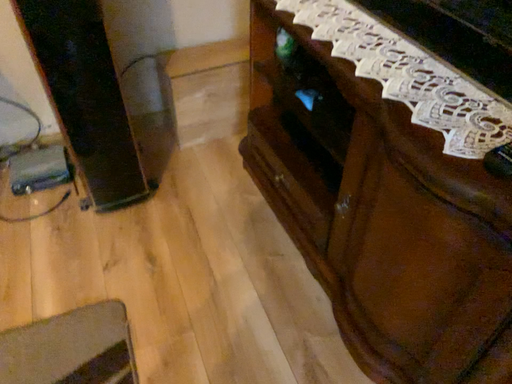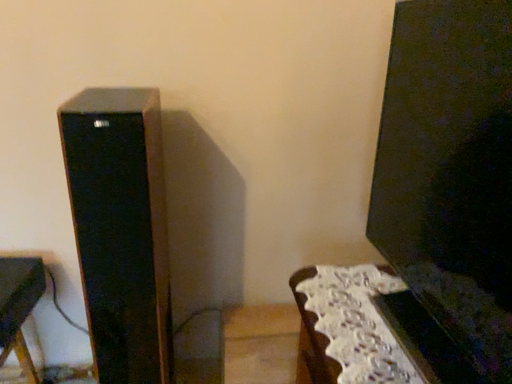
Question: How did the camera likely rotate when shooting the video?

Choices:
 (A) rotated upward
 (B) rotated downward

Answer: (A)